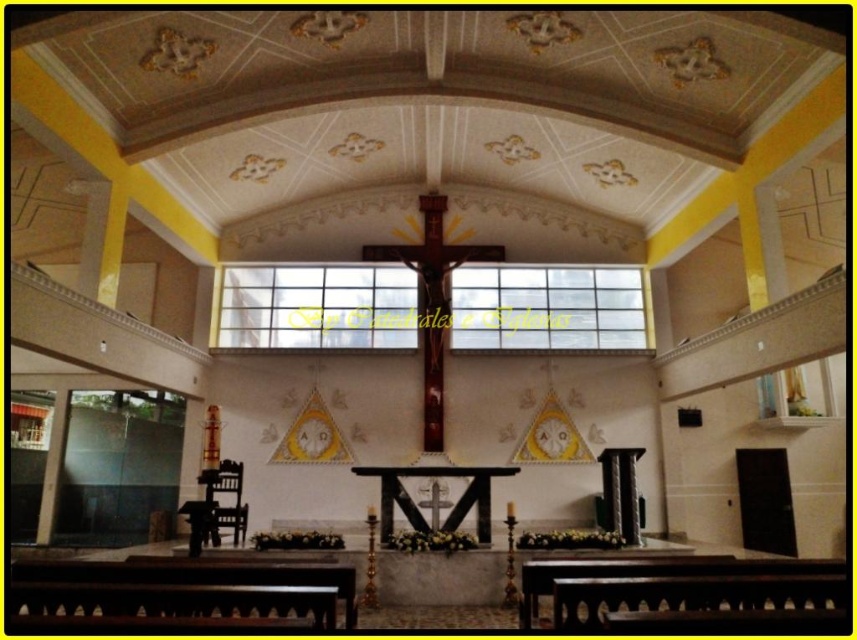
Question: Is brown wooden bench at lower center smaller than black polished wood altar at center?

Choices:
 (A) yes
 (B) no

Answer: (A)

Question: Which point appears closest to the camera in this image?

Choices:
 (A) (388, 528)
 (B) (72, 573)
 (C) (676, 563)

Answer: (B)

Question: Does brown wooden bench at lower left appear over black polished wood altar at center?

Choices:
 (A) yes
 (B) no

Answer: (A)

Question: Which is farther from the black polished wood altar at center?

Choices:
 (A) brown wooden bench at lower center
 (B) brown wooden bench at lower left

Answer: (B)

Question: Does brown wooden bench at lower left appear on the right side of brown wooden bench at lower center?

Choices:
 (A) no
 (B) yes

Answer: (A)

Question: Which object appears closest to the camera in this image?

Choices:
 (A) black polished wood altar at center
 (B) brown wooden bench at lower center

Answer: (B)